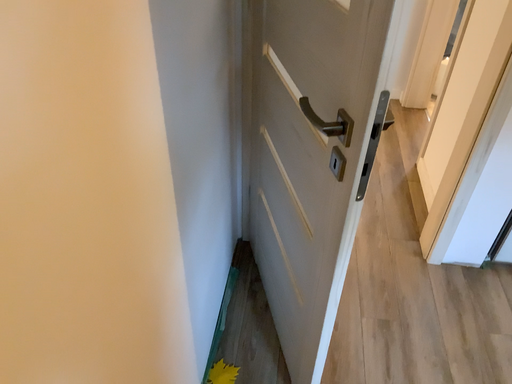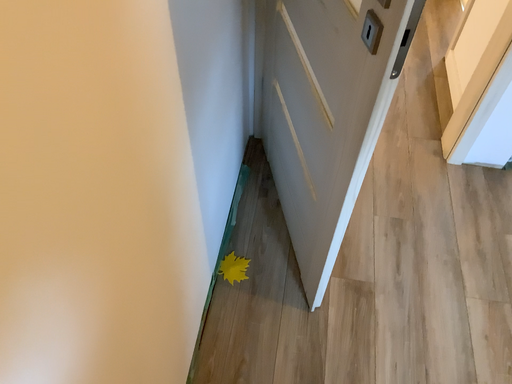
Question: Which way did the camera rotate in the video?

Choices:
 (A) rotated upward
 (B) rotated downward

Answer: (B)